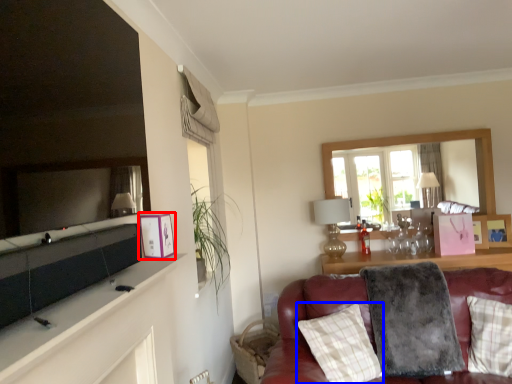
Question: Which object is closer to the camera taking this photo, picture frame (highlighted by a red box) or pillow (highlighted by a blue box)?

Choices:
 (A) picture frame
 (B) pillow

Answer: (A)